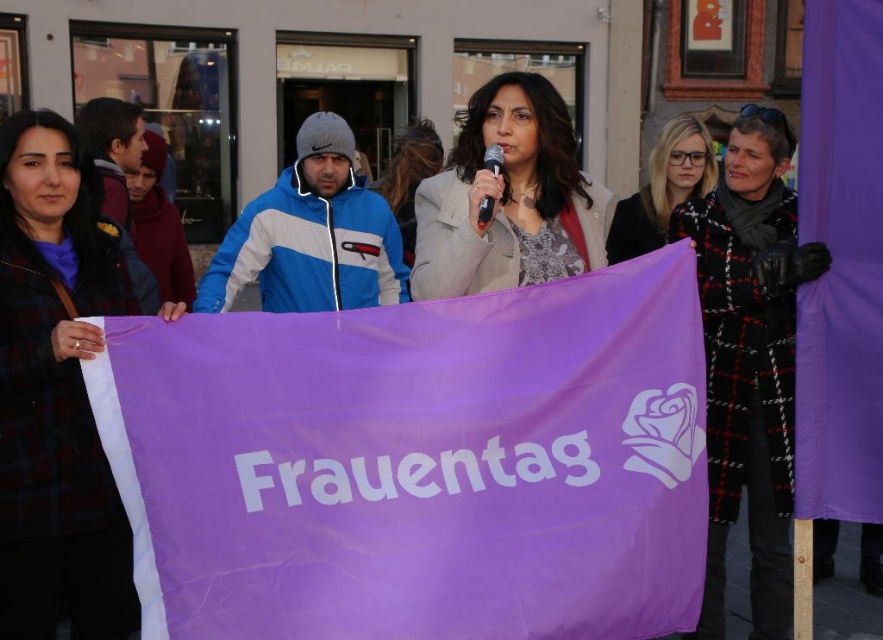
Question: Which object is the closest to the blonde hair at center?

Choices:
 (A) purple fabric banner at center
 (B) matte gray beanie at center

Answer: (B)

Question: Does blonde hair at center come in front of black plastic microphone at center?

Choices:
 (A) yes
 (B) no

Answer: (B)

Question: Does plaid wool coat at left lie in front of matte gray beanie at center?

Choices:
 (A) yes
 (B) no

Answer: (A)

Question: Is plaid wool coat at left below blonde hair at center?

Choices:
 (A) yes
 (B) no

Answer: (A)

Question: Which point is farther to the camera?

Choices:
 (A) plaid wool coat at left
 (B) black checkered coat at center
 (C) black plastic microphone at center
 (D) blonde hair at center

Answer: (D)

Question: Which object appears farthest from the camera in this image?

Choices:
 (A) black checkered coat at center
 (B) plaid wool coat at left

Answer: (A)